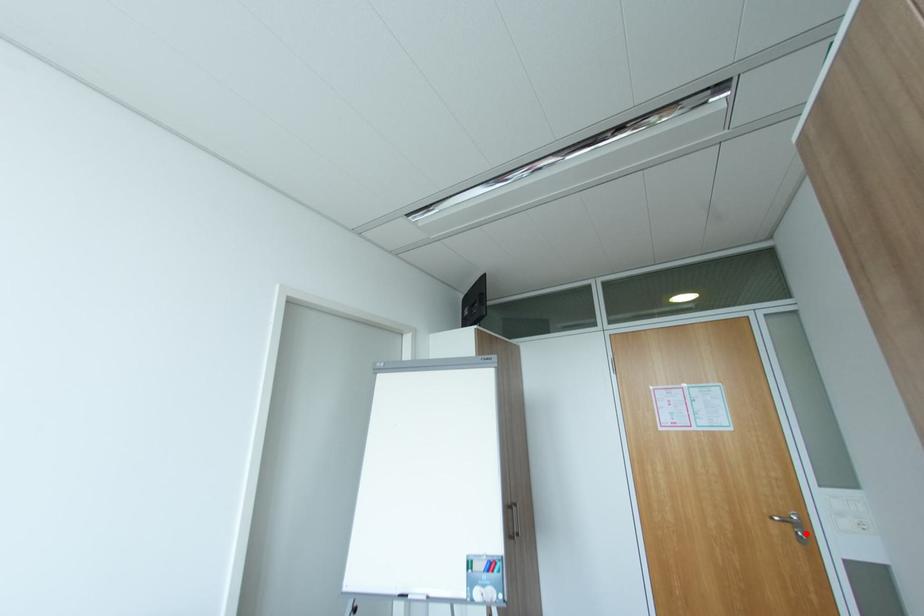
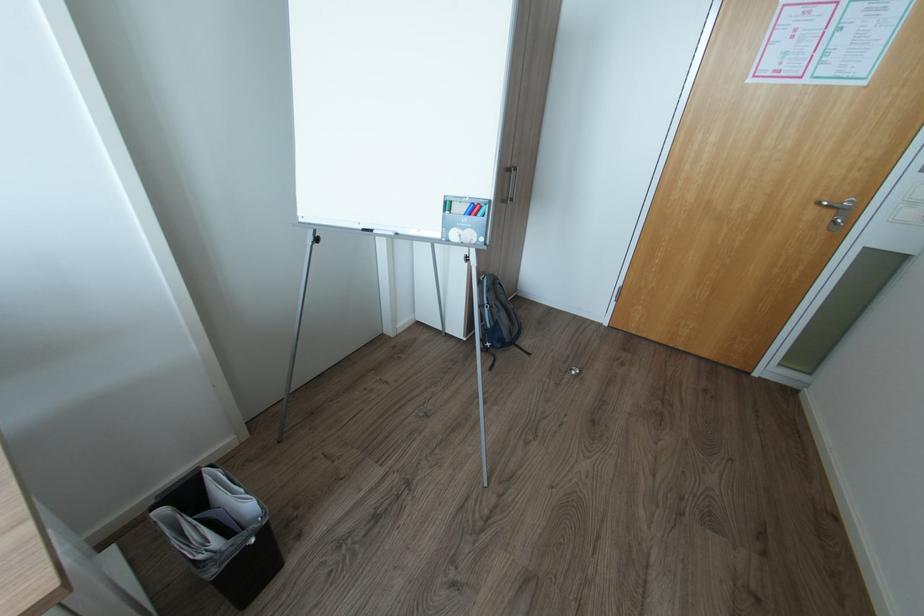
Find the pixel in the second image that matches the highlighted location in the first image.

(845, 221)